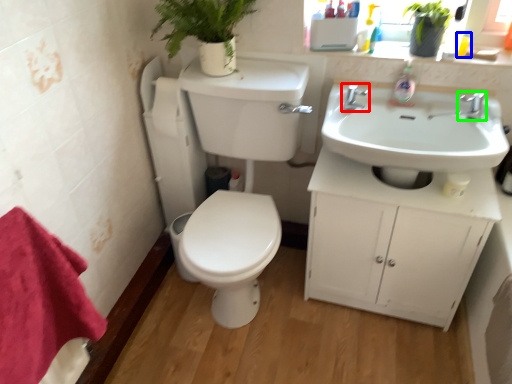
Question: Estimate the real-world distances between objects in this image. Which object is closer to tap (highlighted by a red box), toiletry (highlighted by a blue box) or tap (highlighted by a green box)?

Choices:
 (A) toiletry
 (B) tap

Answer: (B)